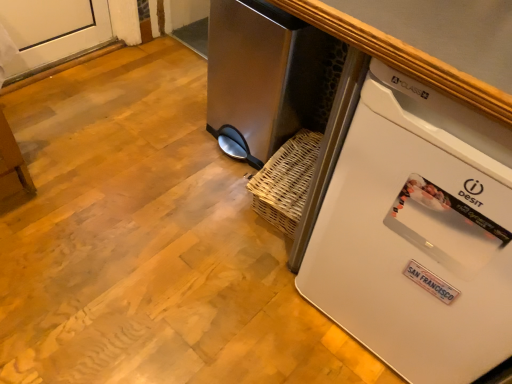
Question: Is white plastic refrigerator at lower right shorter than stainless steel trash can at center?

Choices:
 (A) no
 (B) yes

Answer: (A)

Question: From a real-world perspective, is white plastic refrigerator at lower right physically above stainless steel trash can at center?

Choices:
 (A) no
 (B) yes

Answer: (B)

Question: Can you confirm if white plastic refrigerator at lower right is thinner than stainless steel trash can at center?

Choices:
 (A) yes
 (B) no

Answer: (B)

Question: Does white plastic refrigerator at lower right appear on the left side of stainless steel trash can at center?

Choices:
 (A) yes
 (B) no

Answer: (B)

Question: Does white plastic refrigerator at lower right lie in front of stainless steel trash can at center?

Choices:
 (A) yes
 (B) no

Answer: (A)

Question: Considering the relative positions of white plastic refrigerator at lower right and stainless steel trash can at center in the image provided, is white plastic refrigerator at lower right to the right of stainless steel trash can at center from the viewer's perspective?

Choices:
 (A) yes
 (B) no

Answer: (A)

Question: Does stainless steel trash can at center have a smaller size compared to white plastic refrigerator at lower right?

Choices:
 (A) no
 (B) yes

Answer: (B)

Question: Does stainless steel trash can at center touch white plastic refrigerator at lower right?

Choices:
 (A) yes
 (B) no

Answer: (B)

Question: Can you confirm if stainless steel trash can at center is wider than white plastic refrigerator at lower right?

Choices:
 (A) no
 (B) yes

Answer: (A)

Question: From the image's perspective, does stainless steel trash can at center appear higher than white plastic refrigerator at lower right?

Choices:
 (A) yes
 (B) no

Answer: (A)

Question: Is stainless steel trash can at center closer to the viewer compared to white plastic refrigerator at lower right?

Choices:
 (A) no
 (B) yes

Answer: (A)

Question: Considering the relative sizes of stainless steel trash can at center and white plastic refrigerator at lower right in the image provided, is stainless steel trash can at center shorter than white plastic refrigerator at lower right?

Choices:
 (A) yes
 (B) no

Answer: (A)

Question: From the image's perspective, is stainless steel trash can at center positioned above or below white plastic refrigerator at lower right?

Choices:
 (A) below
 (B) above

Answer: (B)